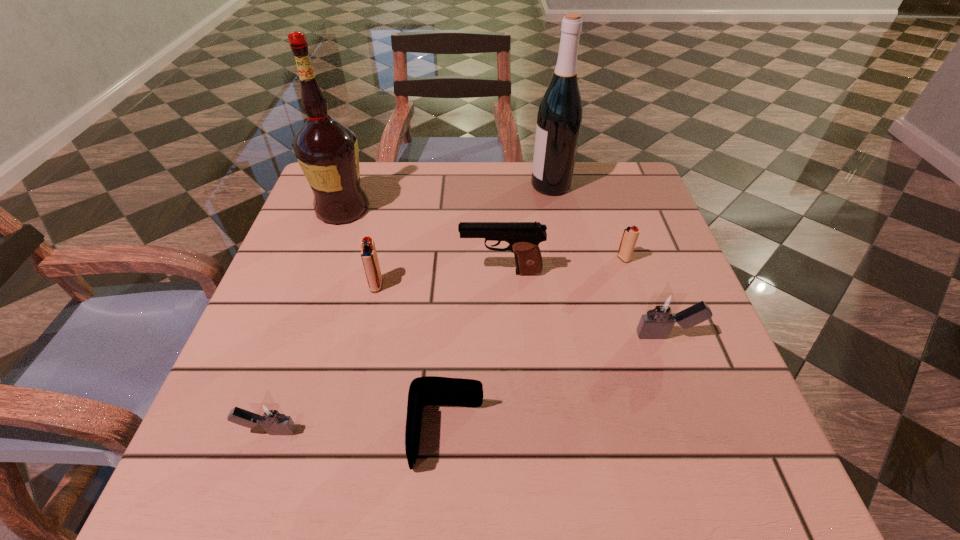
Locate an element on the screen. Image resolution: width=960 pixels, height=540 pixels. the right red igniter is located at coordinates (630, 235).

The height and width of the screenshot is (540, 960). In order to click on the leftmost igniter in this screenshot , I will do `click(269, 414)`.

Find the location of a particular element. the left gray igniter is located at coordinates (269, 414).

Where is `wallet`? wallet is located at coordinates (430, 390).

Where is `vacant space located on the label of the dark wine bottle`? The image size is (960, 540). vacant space located on the label of the dark wine bottle is located at coordinates (428, 185).

Where is `vacant region located 0.050m on the label of the dark wine bottle`? This screenshot has width=960, height=540. vacant region located 0.050m on the label of the dark wine bottle is located at coordinates (512, 185).

The image size is (960, 540). Find the location of `free location located 0.350m on the label of the dark wine bottle`. free location located 0.350m on the label of the dark wine bottle is located at coordinates (397, 185).

This screenshot has height=540, width=960. What are the coordinates of `vacant space located 0.370m on the label of the alcohol` in the screenshot? It's located at (520, 208).

Locate an element on the screen. free region located at the barrel of the pistol is located at coordinates (399, 272).

The height and width of the screenshot is (540, 960). I want to click on vacant region located 0.320m at the barrel of the pistol, so click(x=309, y=272).